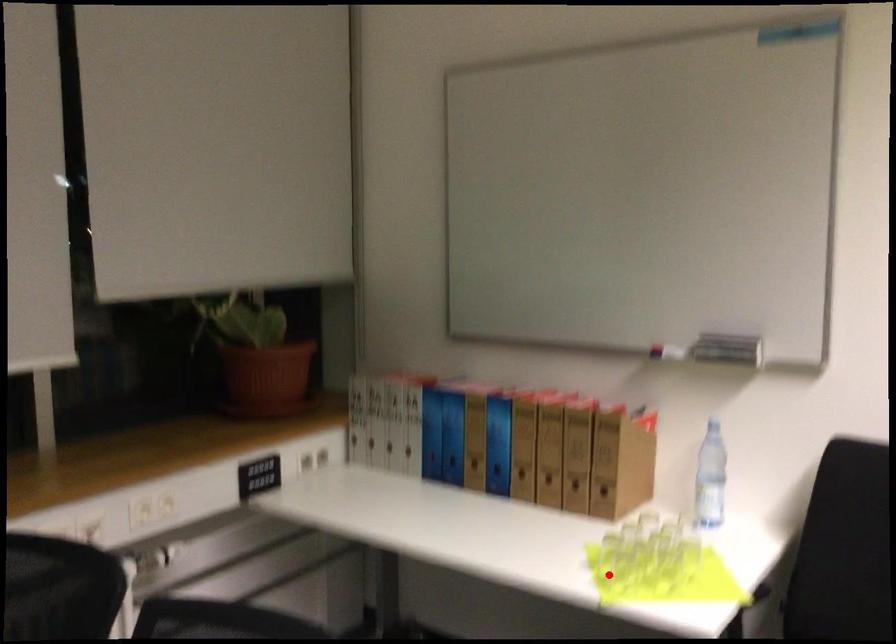
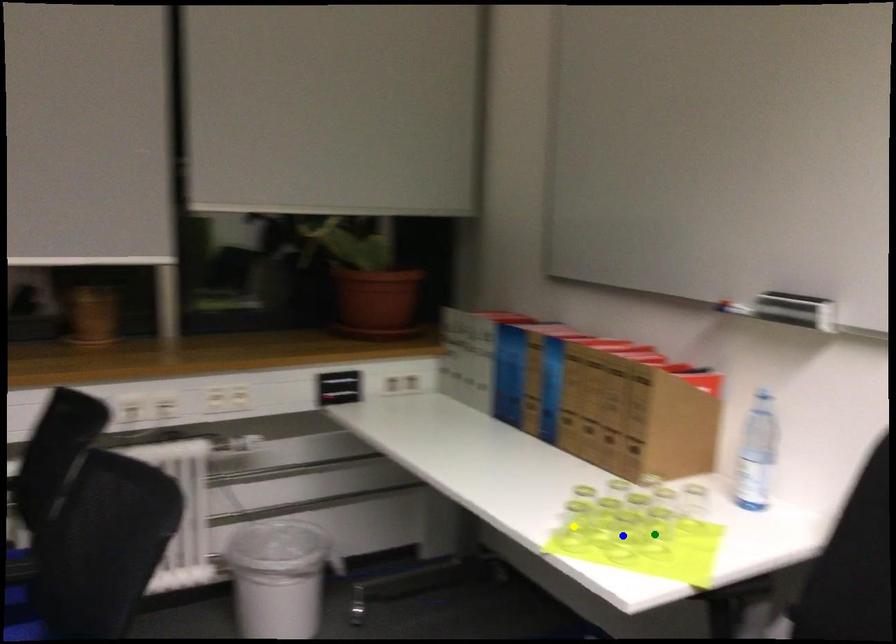
Question: I am providing you with two images of the same scene from different viewpoints. A red point is marked on the first image. You are given multiple points on the second image. Which point in image 2 is actually the same real-world point as the red point in image 1?

Choices:
 (A) green point
 (B) yellow point
 (C) blue point

Answer: (B)